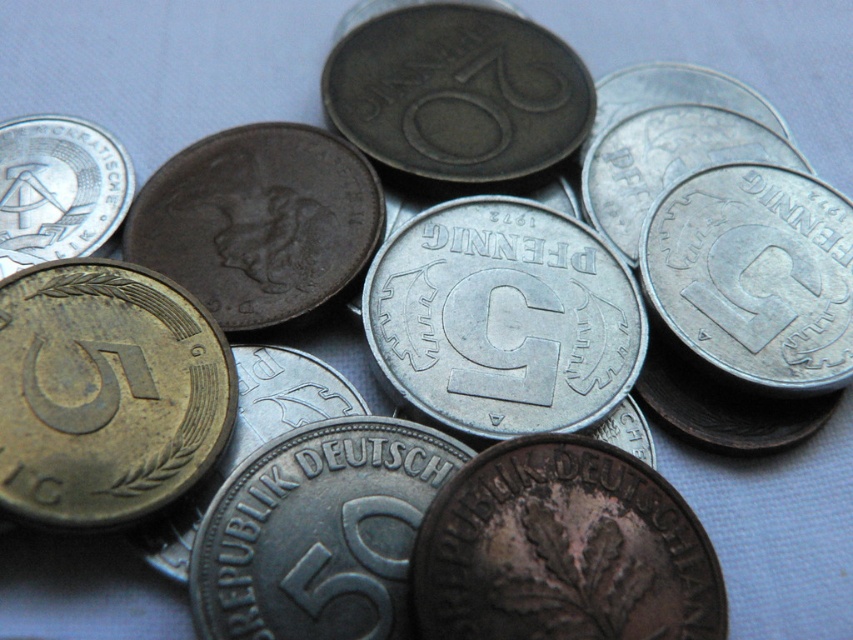
Question: Based on their relative distances, which object is farther from the gold-bronze coin at center-left?

Choices:
 (A) dark gray metallic coin at center
 (B) silver metallic coin at upper left

Answer: (A)

Question: Can you confirm if gold-bronze coin at center-left is thinner than silver metallic coin at upper left?

Choices:
 (A) no
 (B) yes

Answer: (A)

Question: Is gold-bronze coin at center-left thinner than silver metallic coin at upper left?

Choices:
 (A) no
 (B) yes

Answer: (A)

Question: Based on their relative distances, which object is nearer to the dark gray metallic coin at center?

Choices:
 (A) silver metallic coin at upper left
 (B) gold-bronze coin at center-left
 (C) silver metallic coin at center

Answer: (C)

Question: Which of the following is the farthest from the observer?

Choices:
 (A) silver metallic coin at center
 (B) silver metallic coin at upper left

Answer: (B)

Question: From the image, what is the correct spatial relationship of dark gray metallic coin at center in relation to silver metallic coin at upper left?

Choices:
 (A) left
 (B) right

Answer: (B)